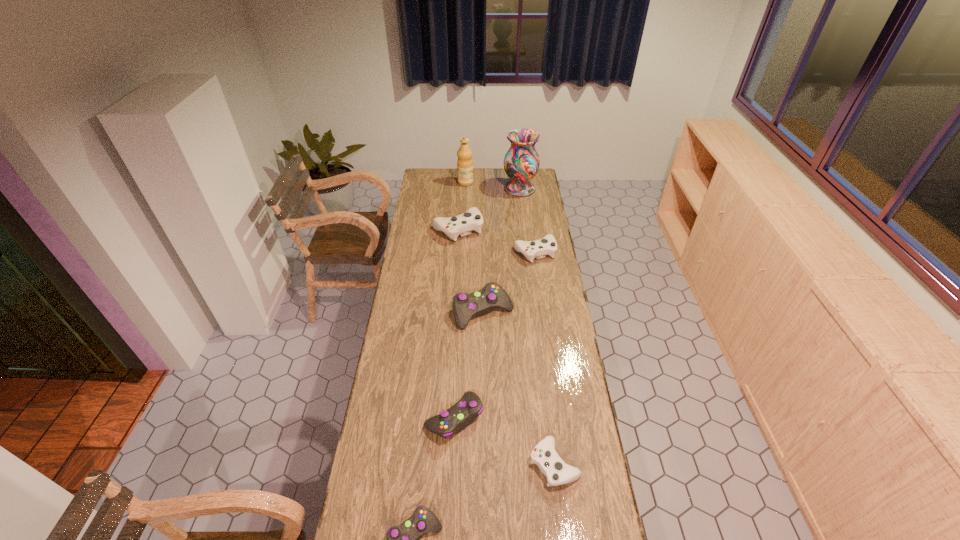
Where is `vacant space at the left edge of the desktop`? vacant space at the left edge of the desktop is located at coordinates (406, 457).

Locate an element on the screen. free space at the right edge is located at coordinates (548, 378).

I want to click on vacant space at the far left corner of the desktop, so click(431, 177).

At what (x,y) coordinates should I click in order to perform the action: click on vacant space that is in between the second biggest gray control and the smallest white control. Please return your answer as a coordinate pair (x, y). The image size is (960, 540). Looking at the image, I should click on (504, 441).

Locate an element on the screen. free space between the nearest white control and the biggest gray control is located at coordinates (518, 388).

This screenshot has width=960, height=540. In order to click on free area in between the farthest gray control and the second biggest white control in this screenshot , I will do `click(509, 282)`.

The image size is (960, 540). Identify the location of vacant area that lies between the second smallest gray control and the second smallest white control. (494, 335).

Locate an element on the screen. The height and width of the screenshot is (540, 960). vacant space in between the fourth nearest object and the vase is located at coordinates (501, 250).

I want to click on unoccupied area between the fifth farthest object and the biggest white control, so click(470, 270).

Locate an element on the screen. This screenshot has width=960, height=540. object that stands as the second closest to the smallest white control is located at coordinates (403, 539).